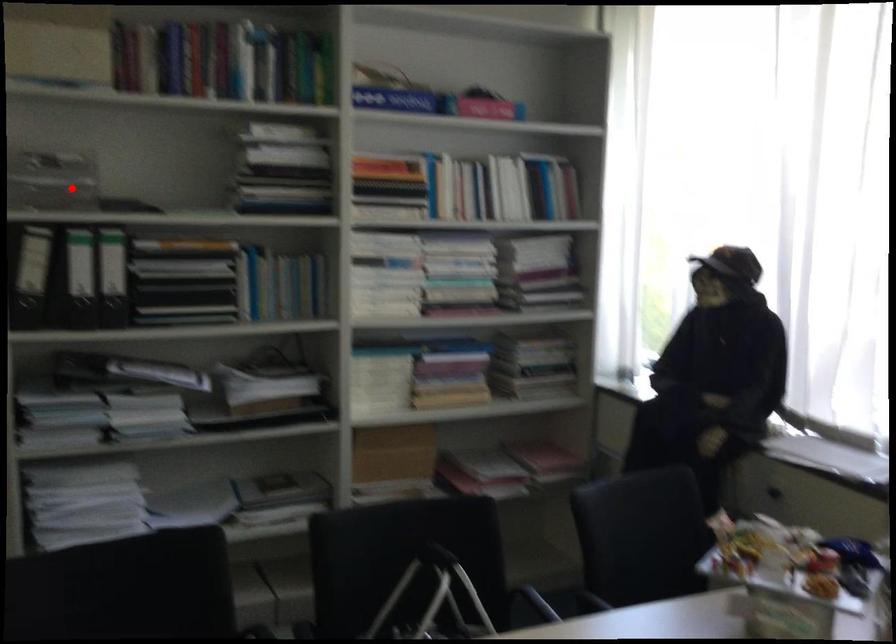
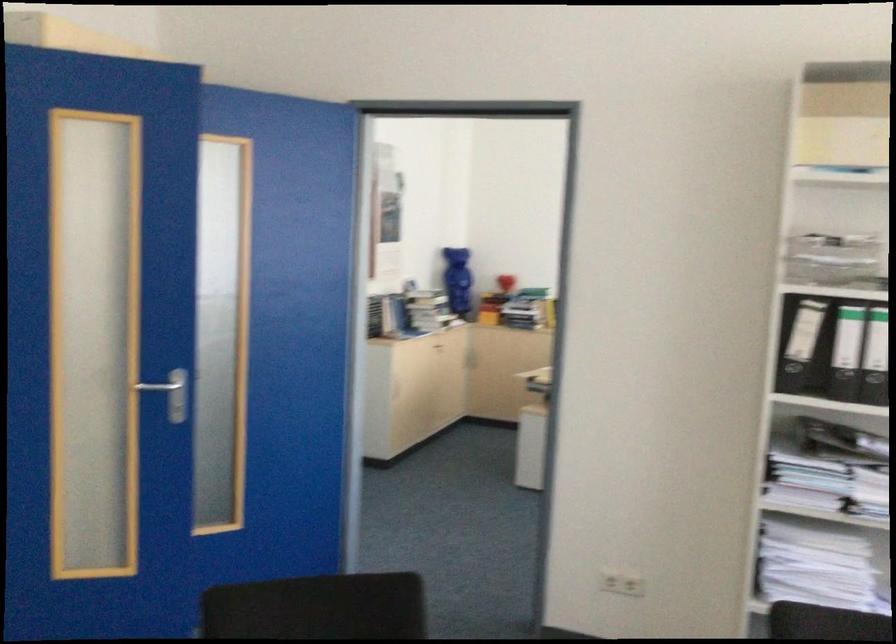
Locate, in the second image, the point that corresponds to the highlighted location in the first image.

(831, 258)